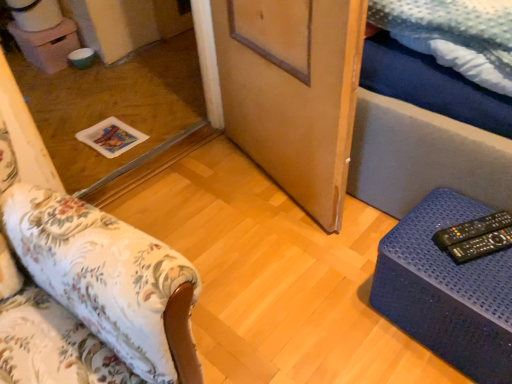
Find the location of a particular element. This screenshot has height=384, width=512. blank area to the left of black plastic remote at lower right, the second remote in the front-to-back sequence is located at coordinates (421, 239).